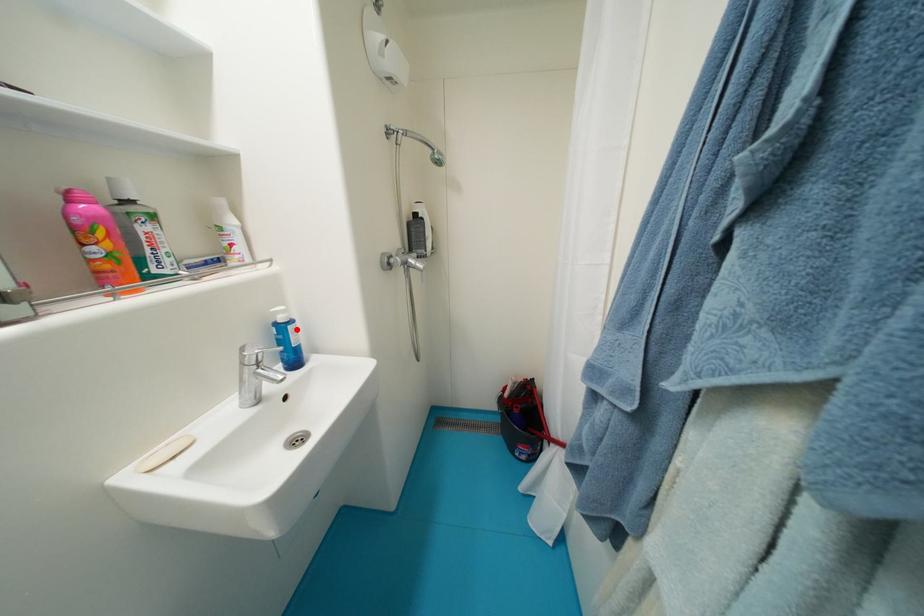
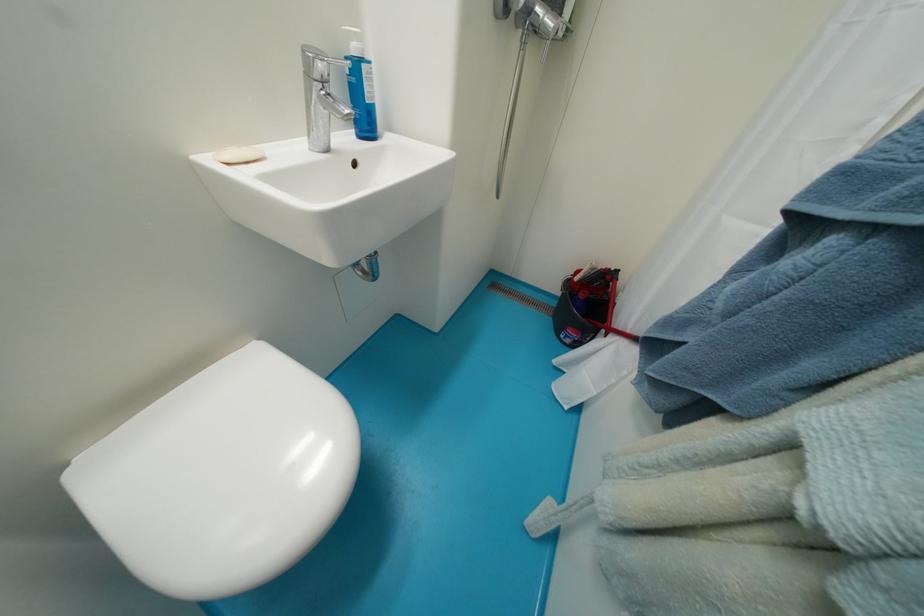
Where in the second image is the point corresponding to the highlighted location from the first image?

(371, 70)